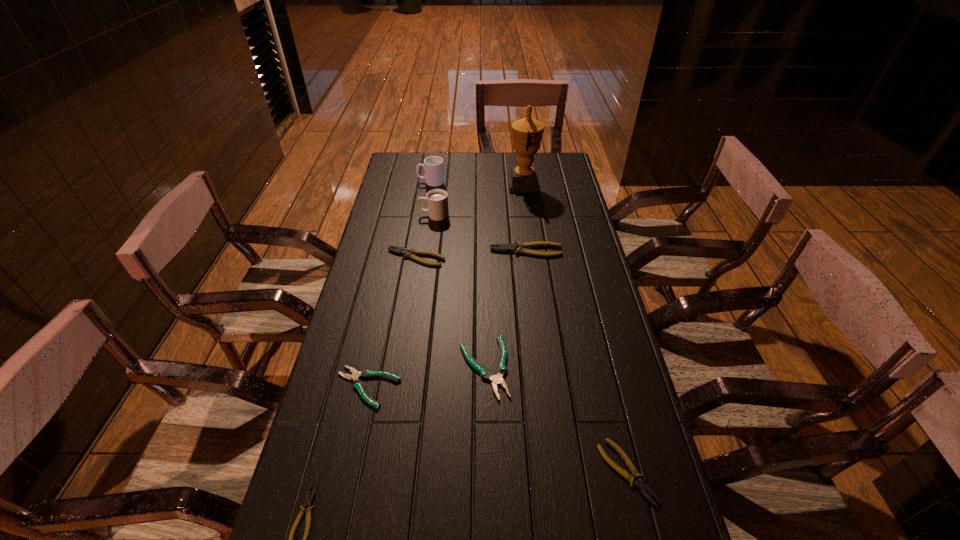
This screenshot has height=540, width=960. Find the location of `golden award`. golden award is located at coordinates (527, 133).

What are the coordinates of `award` in the screenshot? It's located at (527, 133).

Where is `cup`? cup is located at coordinates (434, 171).

I want to click on cappuccino, so click(x=437, y=200).

Identify the location of white cappuccino. pos(437,200).

Locate an element on the screen. This screenshot has height=540, width=960. the tallest pliers is located at coordinates (518, 247).

Where is `the biggest yellow pliers`? This screenshot has height=540, width=960. the biggest yellow pliers is located at coordinates (518, 247).

The image size is (960, 540). What are the coordinates of `the third smallest yellow pliers` in the screenshot? It's located at (410, 252).

At what (x,y) coordinates should I click in order to perform the action: click on the fifth shortest object. Please return your answer as a coordinate pair (x, y). Looking at the image, I should click on (410, 252).

Locate an element on the screen. the bigger teal pliers is located at coordinates (496, 379).